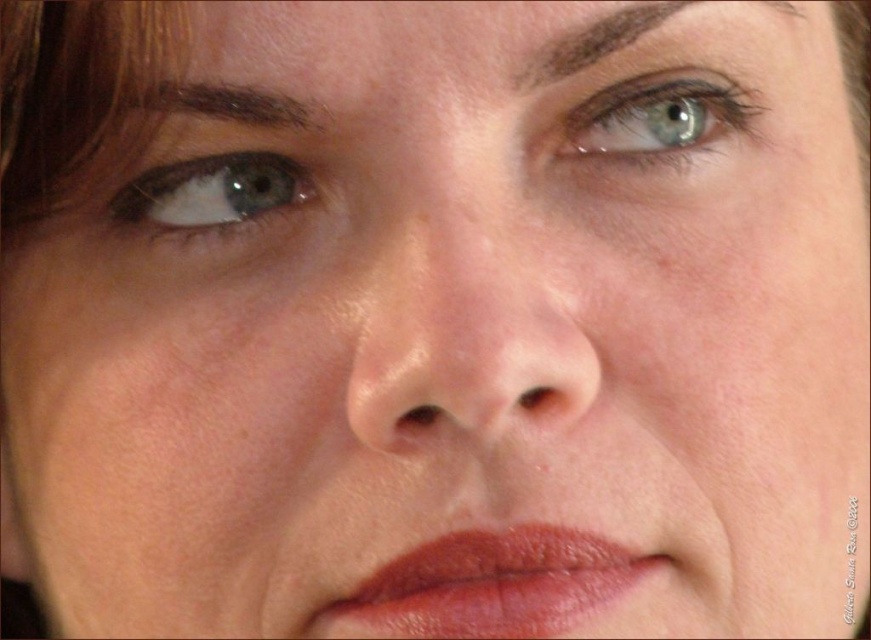
Is point (417, 211) farther from viewer compared to point (515, 628)?

That is True.

Which is more to the left, smooth skin nose at center or matte pink lips at center?

smooth skin nose at center is more to the left.

Is point (478, 342) closer to camera compared to point (505, 550)?

Yes, it is.

The width and height of the screenshot is (871, 640). I want to click on smooth skin nose at center, so click(463, 339).

Can you confirm if matte pink lips at center is bigger than dark brown eyebrow at upper left?

Indeed, matte pink lips at center has a larger size compared to dark brown eyebrow at upper left.

Is matte pink lips at center above dark brown eyebrow at upper left?

No.

Is point (449, 618) positioned in front of point (301, 104)?

That is True.

Where is `matte pink lips at center`? Image resolution: width=871 pixels, height=640 pixels. matte pink lips at center is located at coordinates (488, 586).

Is smooth skin nose at center shorter than blue glossy eye at left?

No, smooth skin nose at center is not shorter than blue glossy eye at left.

Which of these two, smooth skin nose at center or blue glossy eye at left, stands shorter?

blue glossy eye at left

Between point (380, 349) and point (284, 188), which one is positioned in front?

Point (380, 349)

At what (x,y) coordinates should I click in order to perform the action: click on smooth skin nose at center. Please return your answer as a coordinate pair (x, y). The image size is (871, 640). Looking at the image, I should click on (463, 339).